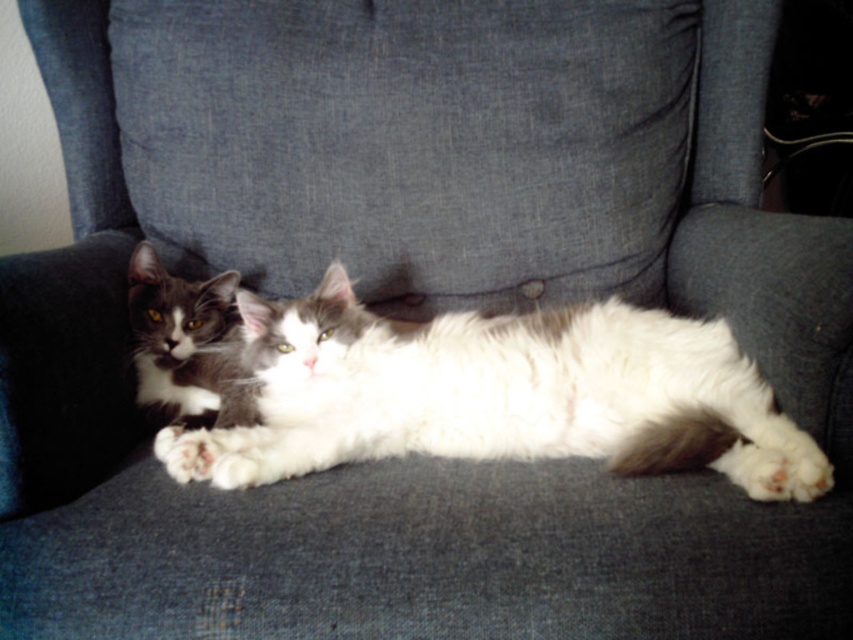
Does point (804, 477) come closer to viewer compared to point (183, 365)?

Yes, it is in front of point (183, 365).

Identify the location of white fluffy cat at center. (498, 394).

You are a GUI agent. You are given a task and a screenshot of the screen. Output one action in this format:
    pyautogui.click(x=<x>, y=<y>)
    Task: Click on the white fluffy cat at center
    This screenshot has width=853, height=640.
    Given the screenshot: What is the action you would take?
    pyautogui.click(x=498, y=394)